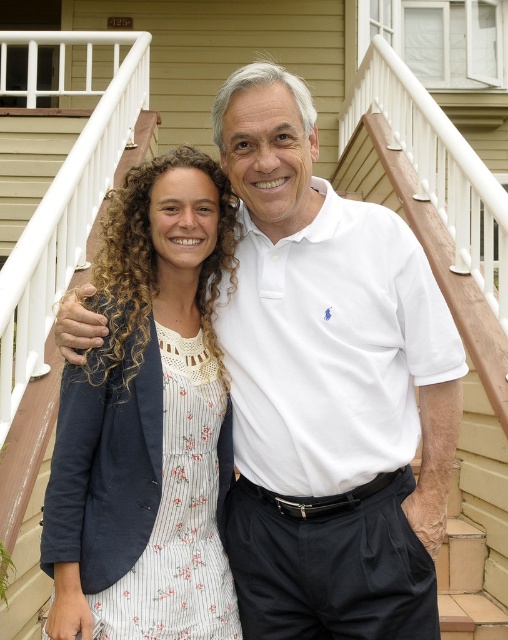
Question: Can you confirm if white cotton polo shirt at center is thinner than wooden at center?

Choices:
 (A) yes
 (B) no

Answer: (B)

Question: Which object is farther from the camera taking this photo?

Choices:
 (A) white cotton polo shirt at center
 (B) white floral dress at center
 (C) wooden at center

Answer: (C)

Question: Based on their relative distances, which object is nearer to the white floral dress at center?

Choices:
 (A) white cotton polo shirt at center
 (B) wooden at center

Answer: (A)

Question: Is white cotton polo shirt at center further to camera compared to wooden at center?

Choices:
 (A) no
 (B) yes

Answer: (A)

Question: Is white floral dress at center smaller than wooden at center?

Choices:
 (A) no
 (B) yes

Answer: (B)

Question: Which object is positioned closest to the white floral dress at center?

Choices:
 (A) wooden at center
 (B) white cotton polo shirt at center

Answer: (B)